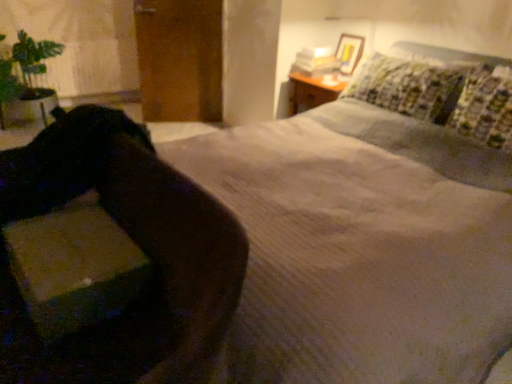
Question: Is matte cardboard box at lower left in front of velvet-like brown swivel chair at lower left?

Choices:
 (A) no
 (B) yes

Answer: (A)

Question: From the image's perspective, does matte cardboard box at lower left appear higher than velvet-like brown swivel chair at lower left?

Choices:
 (A) yes
 (B) no

Answer: (A)

Question: Is matte cardboard box at lower left facing away from velvet-like brown swivel chair at lower left?

Choices:
 (A) no
 (B) yes

Answer: (B)

Question: Is matte cardboard box at lower left completely or partially outside of velvet-like brown swivel chair at lower left?

Choices:
 (A) yes
 (B) no

Answer: (B)

Question: From a real-world perspective, is matte cardboard box at lower left located beneath velvet-like brown swivel chair at lower left?

Choices:
 (A) yes
 (B) no

Answer: (B)

Question: Does matte cardboard box at lower left have a smaller size compared to velvet-like brown swivel chair at lower left?

Choices:
 (A) no
 (B) yes

Answer: (B)

Question: Would you say matte cardboard box at lower left is outside green leafy plant at left?

Choices:
 (A) yes
 (B) no

Answer: (A)

Question: Is matte cardboard box at lower left further to the viewer compared to green leafy plant at left?

Choices:
 (A) yes
 (B) no

Answer: (B)

Question: Is matte cardboard box at lower left turned away from green leafy plant at left?

Choices:
 (A) no
 (B) yes

Answer: (A)

Question: Can you confirm if matte cardboard box at lower left is positioned to the right of green leafy plant at left?

Choices:
 (A) yes
 (B) no

Answer: (A)

Question: Is matte cardboard box at lower left in front of green leafy plant at left?

Choices:
 (A) no
 (B) yes

Answer: (B)

Question: From a real-world perspective, is matte cardboard box at lower left under green leafy plant at left?

Choices:
 (A) no
 (B) yes

Answer: (A)

Question: Considering the relative sizes of velvet-like brown swivel chair at lower left and matte cardboard box at lower left in the image provided, is velvet-like brown swivel chair at lower left wider than matte cardboard box at lower left?

Choices:
 (A) yes
 (B) no

Answer: (A)